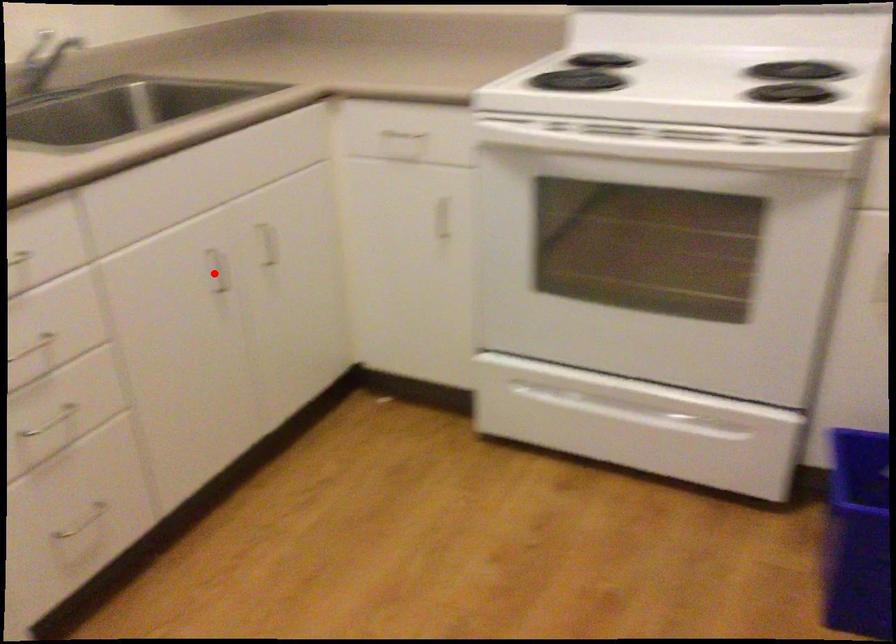
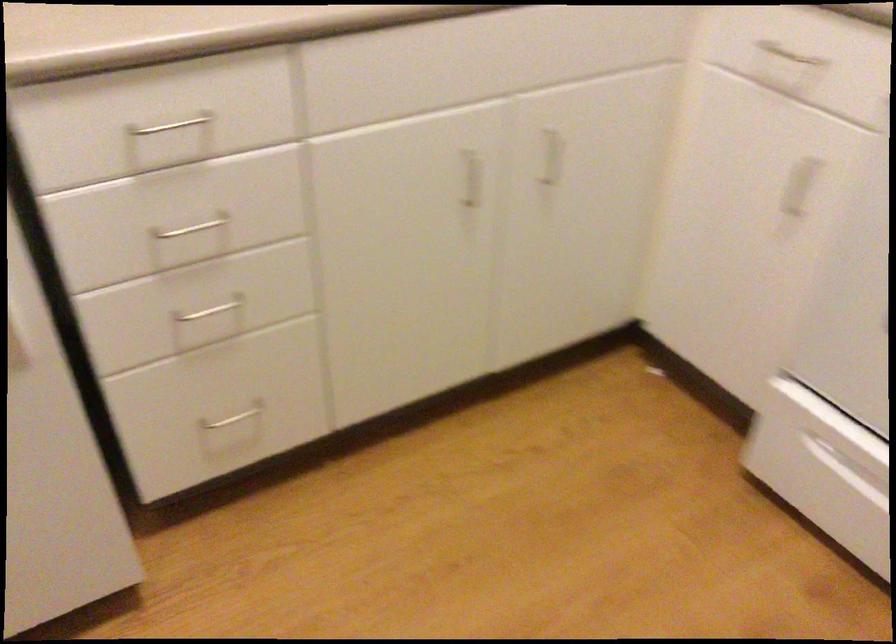
Question: I am providing you with two images of the same scene from different viewpoints. Given a red point in image1, look at the same physical point in image2. Is it:

Choices:
 (A) Closer to the viewpoint
 (B) Farther from the viewpoint

Answer: (A)